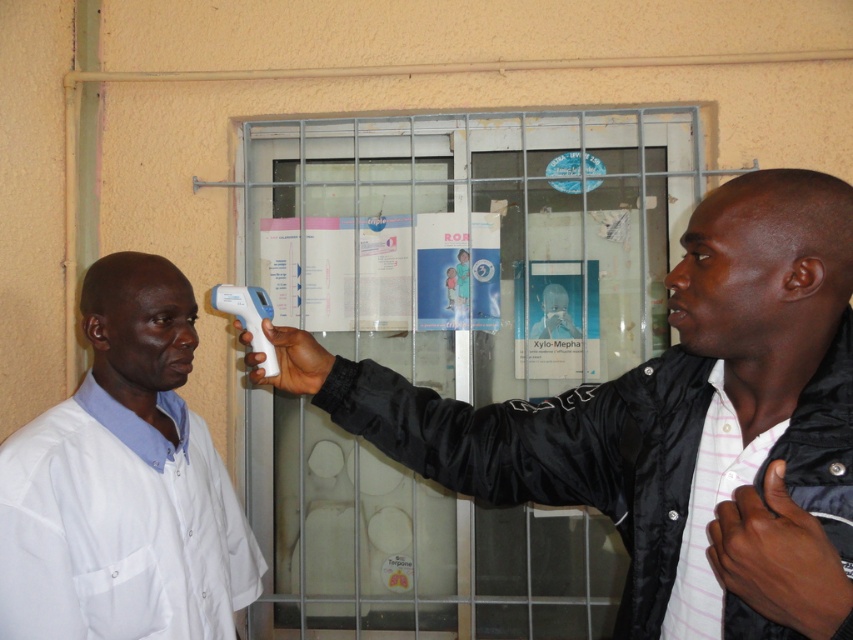
Is white matte thermometer at center wider than white matte lab coat at left?

Correct, the width of white matte thermometer at center exceeds that of white matte lab coat at left.

The width and height of the screenshot is (853, 640). Describe the element at coordinates (668, 416) in the screenshot. I see `white matte thermometer at center` at that location.

Which is behind, point (733, 225) or point (227, 579)?

The point (227, 579) is more distant.

The height and width of the screenshot is (640, 853). What are the coordinates of `white matte thermometer at center` in the screenshot? It's located at (668, 416).